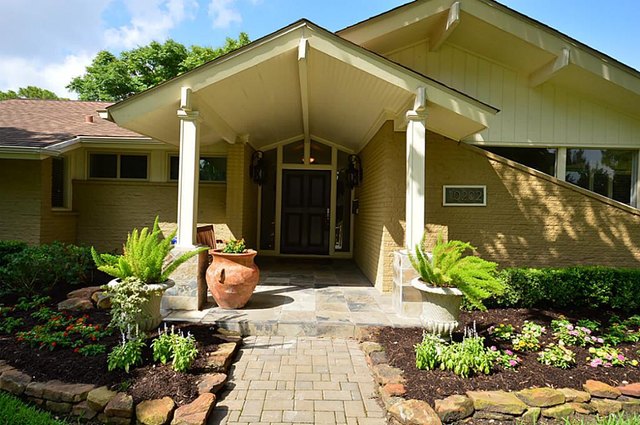
This screenshot has width=640, height=425. I want to click on urn, so click(x=436, y=306), click(x=155, y=295).